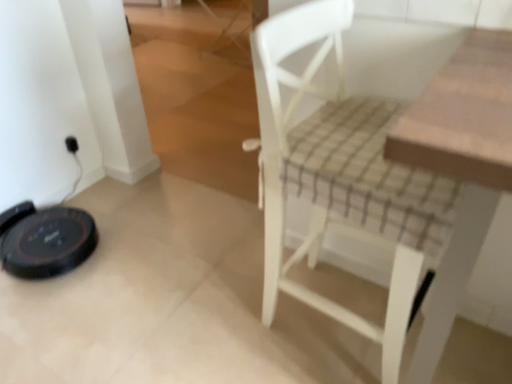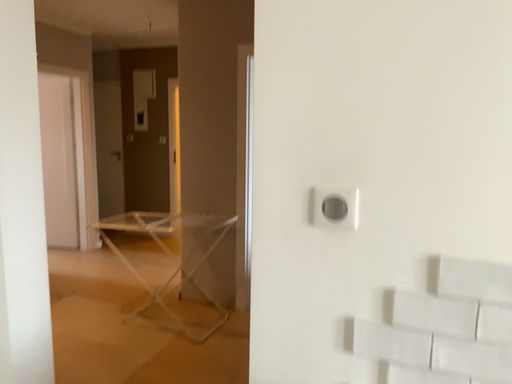
Question: Which way did the camera rotate in the video?

Choices:
 (A) rotated left
 (B) rotated right

Answer: (B)